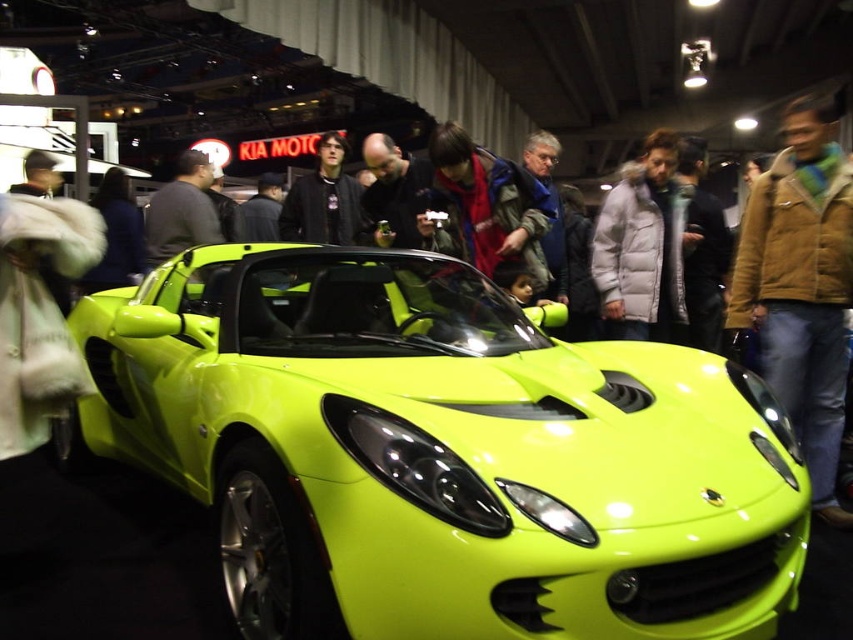
Is lime green matte sports car at center below dark gray sweater at center?

Indeed, lime green matte sports car at center is positioned under dark gray sweater at center.

Which is more to the right, lime green matte sports car at center or dark gray sweater at center?

lime green matte sports car at center

What do you see at coordinates (442, 452) in the screenshot? I see `lime green matte sports car at center` at bounding box center [442, 452].

I want to click on lime green matte sports car at center, so click(x=442, y=452).

Is the position of lime green matte sports car at center more distant than that of brown leather jacket at right?

That is False.

Does lime green matte sports car at center have a lesser width compared to brown leather jacket at right?

In fact, lime green matte sports car at center might be wider than brown leather jacket at right.

This screenshot has width=853, height=640. Describe the element at coordinates (442, 452) in the screenshot. I see `lime green matte sports car at center` at that location.

The width and height of the screenshot is (853, 640). I want to click on lime green matte sports car at center, so click(442, 452).

Between brown leather jacket at right and dark gray sweater at center, which one appears on the right side from the viewer's perspective?

brown leather jacket at right

Who is more forward, (x=820, y=134) or (x=202, y=193)?

Positioned in front is point (x=820, y=134).

This screenshot has width=853, height=640. In order to click on brown leather jacket at right in this screenshot , I will do pyautogui.click(x=801, y=285).